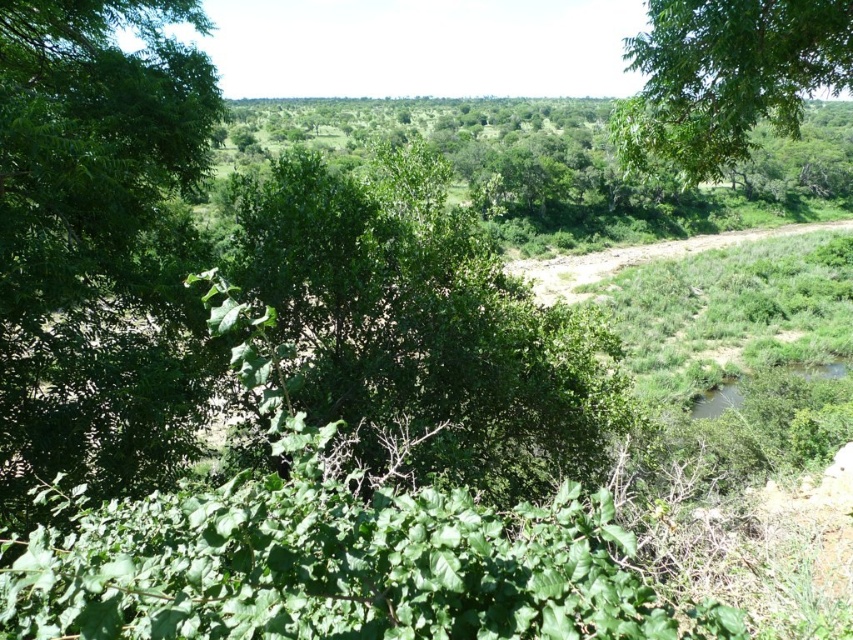
Question: Which object appears closest to the camera in this image?

Choices:
 (A) green leafy tree at upper right
 (B) green leafy tree at center

Answer: (B)

Question: Is green leafy tree at center positioned behind green leafy tree at upper right?

Choices:
 (A) yes
 (B) no

Answer: (B)

Question: Does green leafy tree at center appear under green leafy tree at upper right?

Choices:
 (A) yes
 (B) no

Answer: (B)

Question: Is green leafy tree at center in front of green leafy tree at upper right?

Choices:
 (A) yes
 (B) no

Answer: (A)

Question: Which point is closer to the camera taking this photo?

Choices:
 (A) (389, 212)
 (B) (653, 134)

Answer: (B)

Question: Which of the following is the closest to the observer?

Choices:
 (A) green leafy tree at center
 (B) green leafy tree at upper right

Answer: (A)